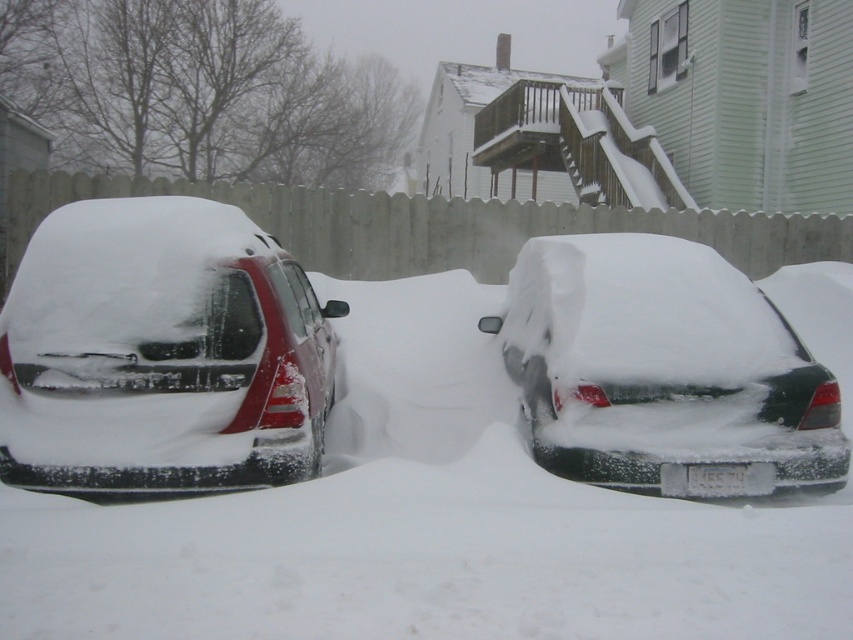
Question: Which point is closer to the camera?

Choices:
 (A) snow-covered sedan at center
 (B) sleek matte red car at left
 (C) white matte car at center

Answer: (C)

Question: Can you confirm if sleek matte red car at left is positioned to the left of snow-covered sedan at center?

Choices:
 (A) no
 (B) yes

Answer: (B)

Question: Can you confirm if white matte car at center is positioned below sleek matte red car at left?

Choices:
 (A) no
 (B) yes

Answer: (B)

Question: Is sleek matte red car at left to the left of snow-covered sedan at center from the viewer's perspective?

Choices:
 (A) no
 (B) yes

Answer: (B)

Question: Which point is farther to the camera?

Choices:
 (A) (91, 608)
 (B) (566, 237)
 (C) (206, 326)

Answer: (B)

Question: Which point is closer to the camera?

Choices:
 (A) [285, 291]
 (B) [703, 464]

Answer: (B)